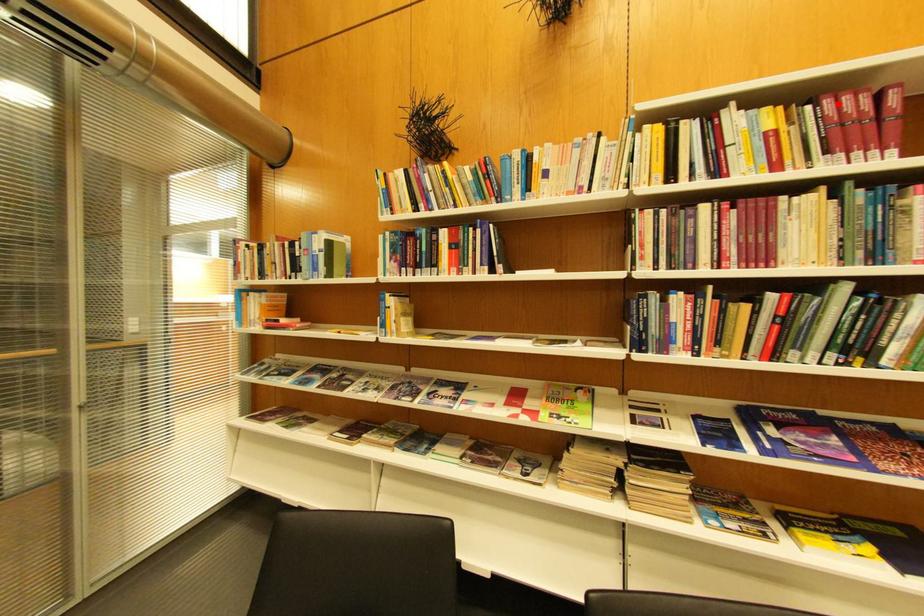
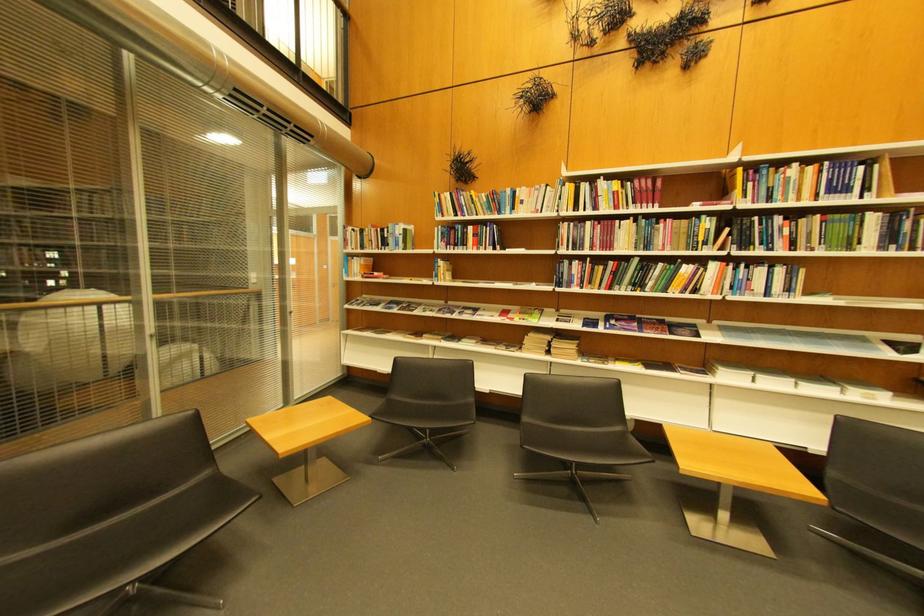
Find the pixel in the second image that matches the highlighted location in the first image.

(648, 183)